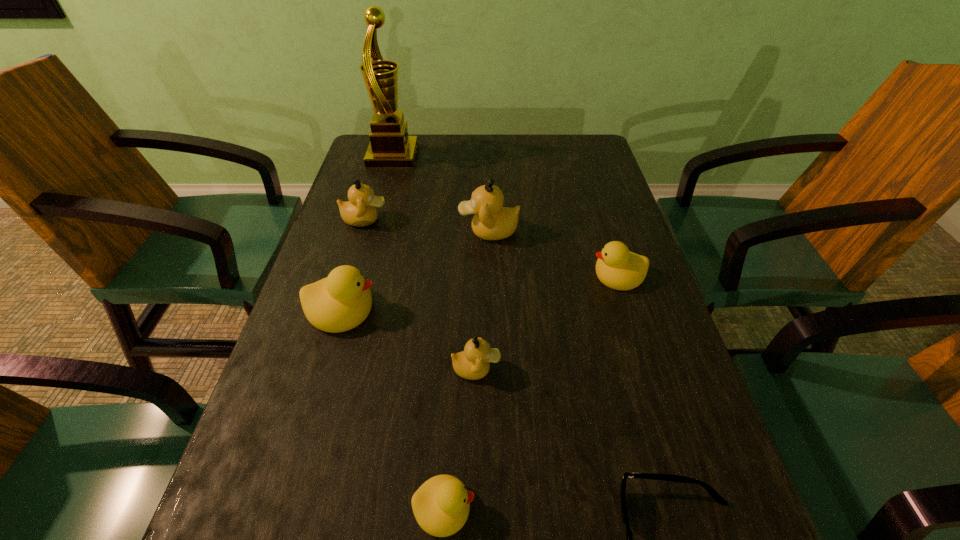
You are a GUI agent. You are given a task and a screenshot of the screen. Output one action in this format:
    pyautogui.click(x=<x>, y=<y>)
    Task: Click on the duckling that is the closest one to the biggest yellow duckling
    
    Given the screenshot: What is the action you would take?
    pyautogui.click(x=473, y=363)

I want to click on tan duckling that is the closest to the nearest tan duckling, so click(x=491, y=221).

Identify which tan duckling is located as the second nearest to the biggest tan duckling. Please provide its 2D coordinates. Your answer should be formatted as a tuple, i.e. [(x, y)], where the tuple contains the x and y coordinates of a point satisfying the conditions above.

[(473, 363)]

Identify the location of the third closest yellow duckling to the leftmost tan duckling. (441, 505).

At what (x,y) coordinates should I click in order to perform the action: click on yellow duckling that is the third closest to the shortest object. Please return your answer as a coordinate pair (x, y). The width and height of the screenshot is (960, 540). Looking at the image, I should click on (340, 302).